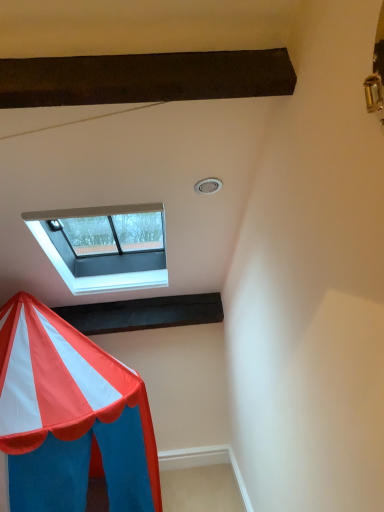
The height and width of the screenshot is (512, 384). What do you see at coordinates (104, 246) in the screenshot? I see `white plastic window at upper center` at bounding box center [104, 246].

Identify the location of white plastic window at upper center. This screenshot has height=512, width=384. (104, 246).

You are a GUI agent. You are given a task and a screenshot of the screen. Output one action in this format:
    pyautogui.click(x=<x>, y=<y>)
    Task: Click on the white plastic window at upper center
    This screenshot has width=384, height=512.
    Given the screenshot: What is the action you would take?
    pyautogui.click(x=104, y=246)